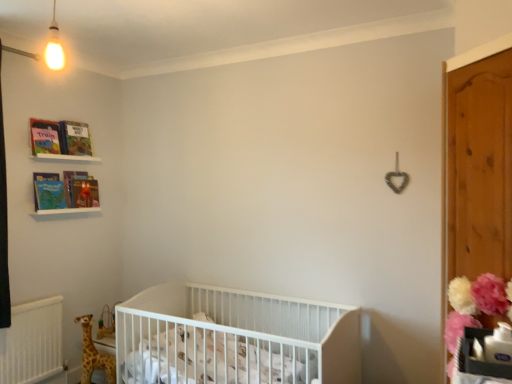
Describe the element at coordinates (94, 354) in the screenshot. I see `spotted fabric giraffe at lower left` at that location.

The width and height of the screenshot is (512, 384). What do you see at coordinates (234, 338) in the screenshot?
I see `white matte crib at center` at bounding box center [234, 338].

The image size is (512, 384). I want to click on white matte crib at center, so click(x=234, y=338).

Where is `white plastic crib at upper left, arranged as the second balustrade when ordered from the bottom`? This screenshot has height=384, width=512. white plastic crib at upper left, arranged as the second balustrade when ordered from the bottom is located at coordinates (66, 157).

This screenshot has width=512, height=384. What do you see at coordinates (48, 191) in the screenshot?
I see `hardcover book at upper left, which is the first book from bottom to top` at bounding box center [48, 191].

Locate an element on the screen. Image resolution: width=512 pixels, height=384 pixels. matte paper book at upper left, which appears as the first magazine when viewed from the top is located at coordinates (44, 136).

Locate an element on the screen. matte paper book at upper left, which ranks as the 2th magazine in top-to-bottom order is located at coordinates (72, 184).

Considering the sizes of spotted fabric giraffe at lower left and white plastic crib at lower left, arranged as the second balustrade when viewed from the top, in the image, is spotted fabric giraffe at lower left taller or shorter than white plastic crib at lower left, arranged as the second balustrade when viewed from the top,?

Considering their sizes, spotted fabric giraffe at lower left has more height than white plastic crib at lower left, arranged as the second balustrade when viewed from the top.

Is spotted fabric giraffe at lower left facing away from white plastic crib at lower left, arranged as the second balustrade when viewed from the top?

No, spotted fabric giraffe at lower left's orientation is not away from white plastic crib at lower left, arranged as the second balustrade when viewed from the top.

Is spotted fabric giraffe at lower left at the left side of white plastic crib at lower left, arranged as the second balustrade when viewed from the top?

Incorrect, spotted fabric giraffe at lower left is not on the left side of white plastic crib at lower left, arranged as the second balustrade when viewed from the top.

Would you say spotted fabric giraffe at lower left is outside white plastic crib at lower left, acting as the first balustrade starting from the bottom?

Yes, spotted fabric giraffe at lower left is outside of white plastic crib at lower left, acting as the first balustrade starting from the bottom.

Considering the sizes of spotted fabric giraffe at lower left and fluffy pink pom-pom at right in the image, is spotted fabric giraffe at lower left bigger or smaller than fluffy pink pom-pom at right?

Considering their sizes, spotted fabric giraffe at lower left takes up less space than fluffy pink pom-pom at right.

Does spotted fabric giraffe at lower left turn towards fluffy pink pom-pom at right?

No, spotted fabric giraffe at lower left is not facing towards fluffy pink pom-pom at right.

The width and height of the screenshot is (512, 384). What are the coordinates of `flower located above the spotted fabric giraffe at lower left (from the image's perspective)` in the screenshot? It's located at pyautogui.click(x=474, y=304).

Can you confirm if white plastic crib at lower left, arranged as the second balustrade when viewed from the top, is shorter than matte cardboard book at upper left, the first book from the top?

Correct, white plastic crib at lower left, arranged as the second balustrade when viewed from the top, is not as tall as matte cardboard book at upper left, the first book from the top.

Identify the location of the 2nd balustrade positioned below the matte cardboard book at upper left, the first book from the top (from the image's perspective). The image size is (512, 384). (66, 211).

Is white plastic crib at lower left, arranged as the second balustrade when viewed from the top, located outside matte cardboard book at upper left, the first book from the top?

Indeed, white plastic crib at lower left, arranged as the second balustrade when viewed from the top, is completely outside matte cardboard book at upper left, the first book from the top.

Is white plastic crib at lower left, arranged as the second balustrade when viewed from the top, aimed at matte cardboard book at upper left, arranged as the second book when ordered from the bottom?

No, white plastic crib at lower left, arranged as the second balustrade when viewed from the top, does not turn towards matte cardboard book at upper left, arranged as the second book when ordered from the bottom.

Locate an element on the screen. flower below the white plastic crib at lower left, acting as the first balustrade starting from the bottom (from a real-world perspective) is located at coordinates (474, 304).

Would you say fluffy pink pom-pom at right is inside or outside white plastic crib at lower left, arranged as the second balustrade when viewed from the top?

fluffy pink pom-pom at right cannot be found inside white plastic crib at lower left, arranged as the second balustrade when viewed from the top.

Is fluffy pink pom-pom at right touching white plastic crib at lower left, arranged as the second balustrade when viewed from the top?

fluffy pink pom-pom at right and white plastic crib at lower left, arranged as the second balustrade when viewed from the top, are not in contact.

Considering the relative sizes of hardcover book at upper left, the second book positioned from the top, and spotted fabric giraffe at lower left in the image provided, is hardcover book at upper left, the second book positioned from the top, thinner than spotted fabric giraffe at lower left?

Correct, the width of hardcover book at upper left, the second book positioned from the top, is less than that of spotted fabric giraffe at lower left.

Is there a large distance between hardcover book at upper left, the second book positioned from the top, and spotted fabric giraffe at lower left?

hardcover book at upper left, the second book positioned from the top, is far away from spotted fabric giraffe at lower left.

Between point (42, 194) and point (87, 366), which one is positioned behind?

The point (42, 194) is farther.

Based on the photo, is white matte crib at center oriented away from fluffy pink pom-pom at right?

No, white matte crib at center's orientation is not away from fluffy pink pom-pom at right.

Is white matte crib at center inside or outside of fluffy pink pom-pom at right?

white matte crib at center is spatially situated outside fluffy pink pom-pom at right.

Is white matte crib at center not close to fluffy pink pom-pom at right?

Indeed, white matte crib at center is not near fluffy pink pom-pom at right.

Is white matte crib at center bigger than fluffy pink pom-pom at right?

Correct, white matte crib at center is larger in size than fluffy pink pom-pom at right.

Is fluffy pink pom-pom at right oriented towards matte paper book at upper left, which is counted as the 2th magazine, starting from the front?

No, fluffy pink pom-pom at right is not aimed at matte paper book at upper left, which is counted as the 2th magazine, starting from the front.

Considering the relative sizes of fluffy pink pom-pom at right and matte paper book at upper left, the 1th magazine positioned from the back, in the image provided, is fluffy pink pom-pom at right thinner than matte paper book at upper left, the 1th magazine positioned from the back,?

No, fluffy pink pom-pom at right is not thinner than matte paper book at upper left, the 1th magazine positioned from the back.

Find the location of a particular element. flower that appears below the matte paper book at upper left, the 1th magazine positioned from the back (from a real-world perspective) is located at coordinates [474, 304].

How many degrees apart are the facing directions of fluffy pink pom-pom at right and matte paper book at upper left, which is counted as the 2th magazine, starting from the front?

The facing directions of fluffy pink pom-pom at right and matte paper book at upper left, which is counted as the 2th magazine, starting from the front, are 140 degrees apart.

Which balustrade is the 2nd one when counting from the left side of the spotted fabric giraffe at lower left? Please provide its 2D coordinates.

[(66, 211)]

The image size is (512, 384). I want to click on giraffe beneath the fluffy pink pom-pom at right (from a real-world perspective), so click(94, 354).

Looking at the image, which one is located further to matte paper book at upper left, the 1th magazine positioned from the back, matte paper book at upper left, which is the second magazine from back to front, or fluffy pink pom-pom at right?

fluffy pink pom-pom at right lies further to matte paper book at upper left, the 1th magazine positioned from the back, than the other object.

Consider the image. Looking at the image, which one is located closer to white matte crib at center, white plastic crib at lower left, acting as the first balustrade starting from the bottom, or spotted fabric giraffe at lower left?

The object closer to white matte crib at center is spotted fabric giraffe at lower left.

Which object lies further to the anchor point matte cardboard book at upper left, arranged as the second book when ordered from the bottom, fluffy pink pom-pom at right or spotted fabric giraffe at lower left?

fluffy pink pom-pom at right is further to matte cardboard book at upper left, arranged as the second book when ordered from the bottom.

Which object lies nearer to the anchor point white plastic crib at upper left, arranged as the second balustrade when ordered from the bottom, matte paper book at upper left, marked as the first magazine in a front-to-back arrangement, or matte paper book at upper left, which is counted as the 2th magazine, starting from the front?

matte paper book at upper left, marked as the first magazine in a front-to-back arrangement, lies closer to white plastic crib at upper left, arranged as the second balustrade when ordered from the bottom, than the other object.

Which object lies further to the anchor point matte cardboard book at upper left, arranged as the second book when ordered from the bottom, white matte crib at center or fluffy pink pom-pom at right?

fluffy pink pom-pom at right.

Looking at the image, which one is located further to white plastic crib at upper left, positioned as the 1th balustrade in top-to-bottom order, white matte crib at center or matte cardboard book at upper left, the first book from the top?

→ white matte crib at center is further to white plastic crib at upper left, positioned as the 1th balustrade in top-to-bottom order.

When comparing their distances from fluffy pink pom-pom at right, does spotted fabric giraffe at lower left or hardcover book at upper left, which is the first book from bottom to top, seem further?

Among the two, hardcover book at upper left, which is the first book from bottom to top, is located further to fluffy pink pom-pom at right.

Based on their spatial positions, is white plastic crib at upper left, arranged as the second balustrade when ordered from the bottom, or spotted fabric giraffe at lower left further from white matte crib at center?

Based on the image, white plastic crib at upper left, arranged as the second balustrade when ordered from the bottom, appears to be further to white matte crib at center.

Where is `balustrade between hardcover book at upper left, which is the first book from bottom to top, and spotted fabric giraffe at lower left vertically`? Image resolution: width=512 pixels, height=384 pixels. balustrade between hardcover book at upper left, which is the first book from bottom to top, and spotted fabric giraffe at lower left vertically is located at coordinates (66, 211).

This screenshot has height=384, width=512. I want to click on infant bed between matte paper book at upper left, the 1th magazine positioned from the back, and spotted fabric giraffe at lower left from top to bottom, so [234, 338].

This screenshot has height=384, width=512. What are the coordinates of `magazine that lies between white plastic crib at upper left, positioned as the 1th balustrade in top-to-bottom order, and white plastic crib at lower left, acting as the first balustrade starting from the bottom, from top to bottom` in the screenshot? It's located at coord(72,184).

Find the location of a particular element. The height and width of the screenshot is (384, 512). book between matte cardboard book at upper left, arranged as the second book when ordered from the bottom, and spotted fabric giraffe at lower left vertically is located at coordinates (48, 191).